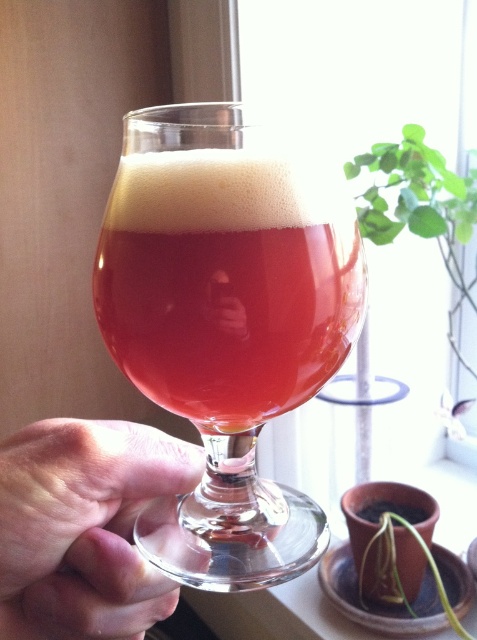
Question: Does transparent glass at center come in front of green leafy plant at lower right?

Choices:
 (A) yes
 (B) no

Answer: (A)

Question: In this image, where is transparent glass at lower center located relative to green leafy plant at lower right?

Choices:
 (A) below
 (B) above

Answer: (B)

Question: Does transparent glass at center appear over green leafy plant at lower right?

Choices:
 (A) yes
 (B) no

Answer: (A)

Question: Which object appears closest to the camera in this image?

Choices:
 (A) transparent glass at lower center
 (B) green leafy plant at lower right
 (C) transparent glass at center
 (D) green leafy plant at upper right

Answer: (A)

Question: Which point is closer to the camera?

Choices:
 (A) (404, 524)
 (B) (11, 632)

Answer: (B)

Question: Which of the following is the closest to the observer?

Choices:
 (A) (468, 301)
 (B) (431, 557)
 (C) (219, 372)

Answer: (C)